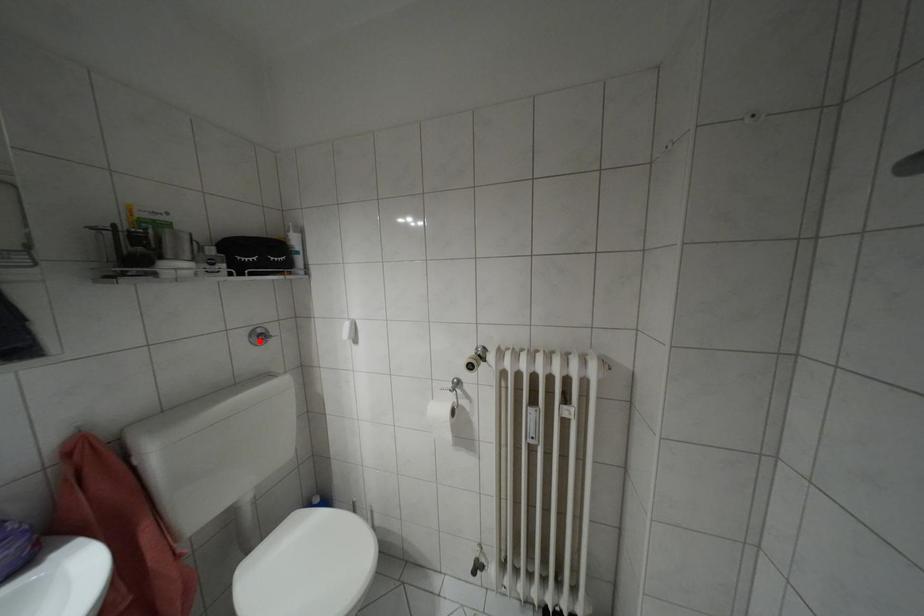
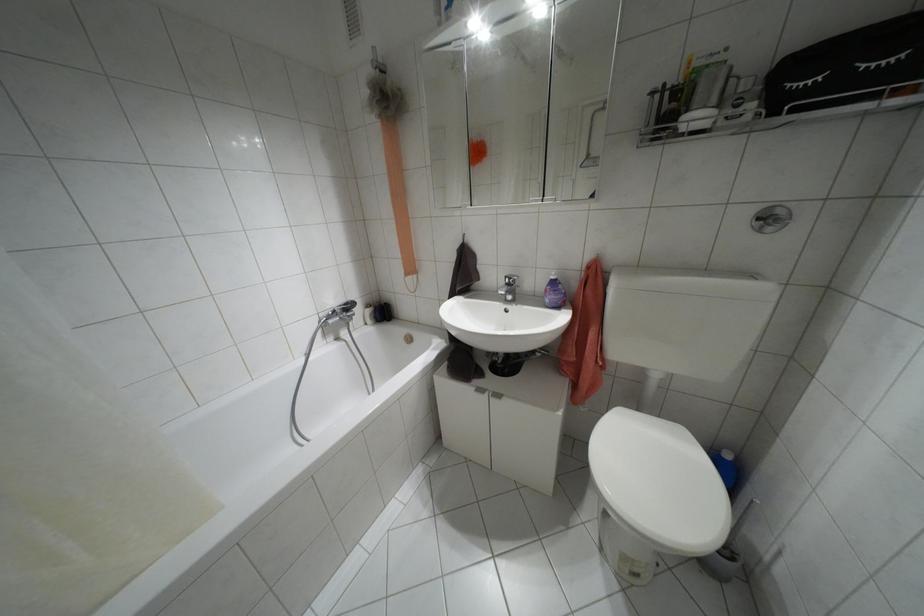
The point at the highlighted location is marked in the first image. Where is the corresponding point in the second image?

(769, 228)